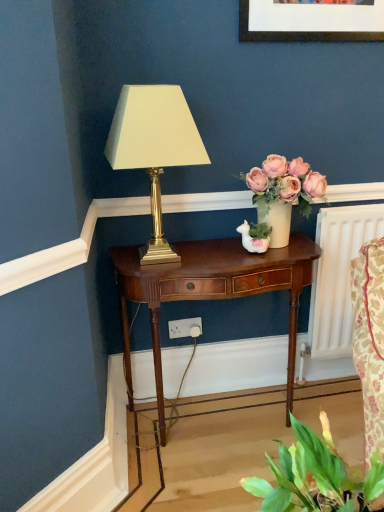
Question: From the image's perspective, does green leafy plant at lower right appear higher than mahogany wood nightstand at center?

Choices:
 (A) no
 (B) yes

Answer: (A)

Question: Does green leafy plant at lower right have a lesser width compared to mahogany wood nightstand at center?

Choices:
 (A) yes
 (B) no

Answer: (A)

Question: Would you say green leafy plant at lower right contains mahogany wood nightstand at center?

Choices:
 (A) no
 (B) yes

Answer: (A)

Question: Is green leafy plant at lower right completely or partially outside of mahogany wood nightstand at center?

Choices:
 (A) no
 (B) yes

Answer: (B)

Question: Is the surface of green leafy plant at lower right in direct contact with mahogany wood nightstand at center?

Choices:
 (A) no
 (B) yes

Answer: (A)

Question: Can you confirm if green leafy plant at lower right is smaller than mahogany wood nightstand at center?

Choices:
 (A) yes
 (B) no

Answer: (A)

Question: Does green leafy plant at lower right have a smaller size compared to matte cream vase with pink roses at center?

Choices:
 (A) no
 (B) yes

Answer: (B)

Question: Considering the relative positions of green leafy plant at lower right and matte cream vase with pink roses at center in the image provided, is green leafy plant at lower right in front of matte cream vase with pink roses at center?

Choices:
 (A) no
 (B) yes

Answer: (B)

Question: Is green leafy plant at lower right at the left side of matte cream vase with pink roses at center?

Choices:
 (A) no
 (B) yes

Answer: (B)

Question: Is green leafy plant at lower right to the right of matte cream vase with pink roses at center from the viewer's perspective?

Choices:
 (A) no
 (B) yes

Answer: (A)

Question: Is green leafy plant at lower right bigger than matte cream vase with pink roses at center?

Choices:
 (A) yes
 (B) no

Answer: (B)

Question: From a real-world perspective, is green leafy plant at lower right located higher than matte cream vase with pink roses at center?

Choices:
 (A) yes
 (B) no

Answer: (B)

Question: Is there a large distance between matte cream vase with pink roses at center and gold metallic lamp at center?

Choices:
 (A) yes
 (B) no

Answer: (B)